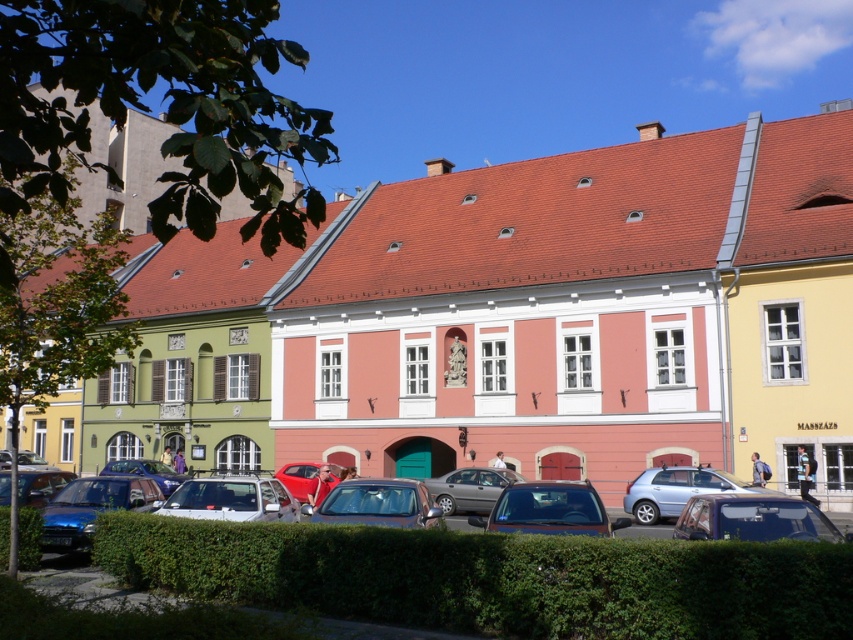
Between point (722, 493) and point (662, 486), which one is positioned behind?

The point (662, 486) is more distant.

Is metallic silver car at lower right bigger than silver metallic suv at center?

Yes.

You are a GUI agent. You are given a task and a screenshot of the screen. Output one action in this format:
    pyautogui.click(x=<x>, y=<y>)
    Task: Click on the metallic silver car at lower right
    
    Given the screenshot: What is the action you would take?
    pyautogui.click(x=753, y=518)

Image resolution: width=853 pixels, height=640 pixels. What do you see at coordinates (28, 538) in the screenshot?
I see `green leafy hedge at lower left` at bounding box center [28, 538].

Which is above, green leafy hedge at lower left or shiny red car at center?

green leafy hedge at lower left is above.

Which is behind, point (32, 556) or point (299, 474)?

Positioned behind is point (299, 474).

Locate an element on the screen. This screenshot has height=640, width=853. green leafy hedge at lower left is located at coordinates (28, 538).

Does point (727, 499) come in front of point (543, 486)?

That is True.

Between point (738, 525) and point (508, 524), which one is positioned behind?

The point (508, 524) is more distant.

Locate an element on the screen. Image resolution: width=853 pixels, height=640 pixels. metallic silver car at lower right is located at coordinates (753, 518).